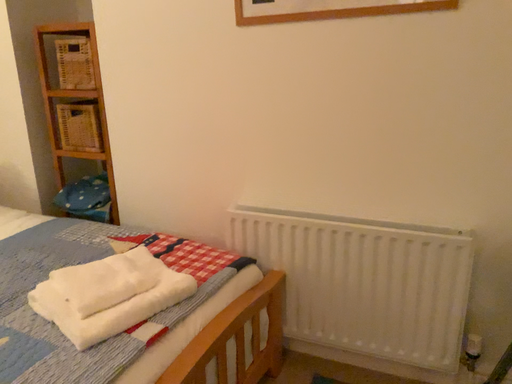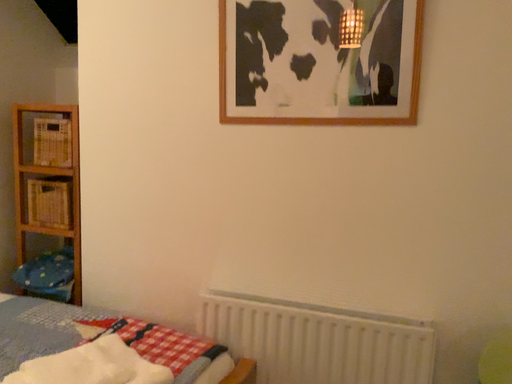
Question: Which way did the camera rotate in the video?

Choices:
 (A) rotated upward
 (B) rotated downward

Answer: (A)